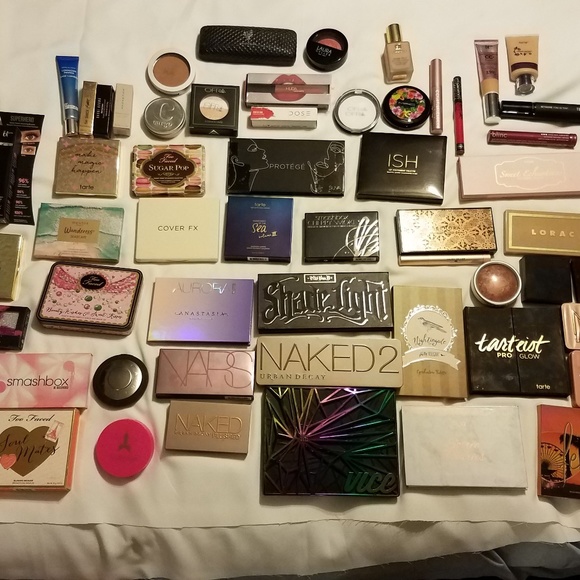
This screenshot has width=580, height=580. I want to click on makeup products, so click(253, 300).